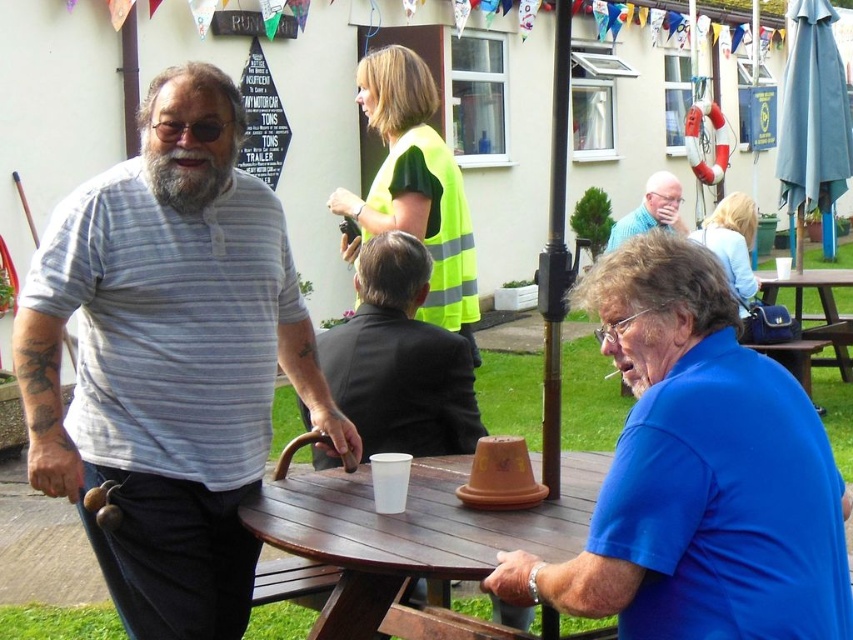
Is blue matte shirt at center wider than wooden table at center?

No.

Does blue matte shirt at center have a greater height compared to wooden table at center?

Indeed, blue matte shirt at center has a greater height compared to wooden table at center.

Is point (679, 582) positioned behind point (306, 529)?

No, it is not.

You are a GUI agent. You are given a task and a screenshot of the screen. Output one action in this format:
    pyautogui.click(x=<x>, y=<y>)
    Task: Click on the blue matte shirt at center
    This screenshot has width=853, height=640.
    Given the screenshot: What is the action you would take?
    pyautogui.click(x=698, y=472)

Who is more distant from viewer, (137, 387) or (563, 452)?

The point (563, 452) is more distant.

Does point (90, 355) lie behind point (437, 545)?

That is True.

The width and height of the screenshot is (853, 640). What are the coordinates of `gray striped shirt at left` in the screenshot? It's located at (169, 358).

The image size is (853, 640). I want to click on gray striped shirt at left, so click(x=169, y=358).

Can you confirm if wooden table at center is bigger than matte black suit at center?

Correct, wooden table at center is larger in size than matte black suit at center.

Which is behind, point (392, 515) or point (381, 269)?

Point (381, 269)

Locate an element on the screen. Image resolution: width=853 pixels, height=640 pixels. wooden table at center is located at coordinates (412, 531).